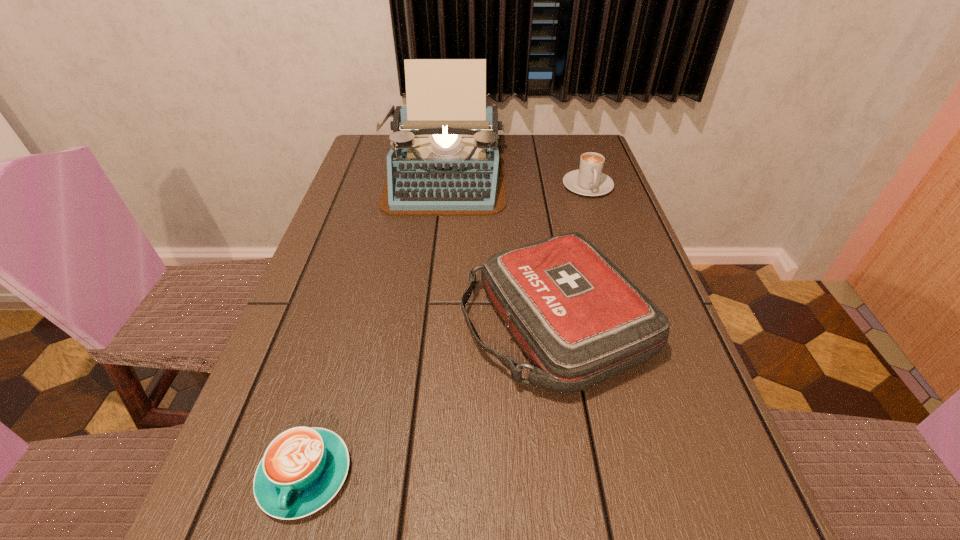
At what (x,y) coordinates should I click in order to perform the action: click on free point that satisfies the following two spatial constraints: 1. on the typing side of the second nearest object; 2. on the right side of the tallest object. Please return your answer as a coordinate pair (x, y). The width and height of the screenshot is (960, 540). Looking at the image, I should click on (427, 323).

Locate an element on the screen. Image resolution: width=960 pixels, height=540 pixels. free region that satisfies the following two spatial constraints: 1. on the typing side of the first-aid kit; 2. on the left side of the tallest object is located at coordinates (427, 323).

Identify the location of free location that satisfies the following two spatial constraints: 1. on the typing side of the second nearest object; 2. on the right side of the tallest object. (427, 323).

At what (x,y) coordinates should I click in order to perform the action: click on vacant space that satisfies the following two spatial constraints: 1. on the typing side of the typewriter; 2. on the right side of the third farthest object. Please return your answer as a coordinate pair (x, y). The height and width of the screenshot is (540, 960). Looking at the image, I should click on (427, 323).